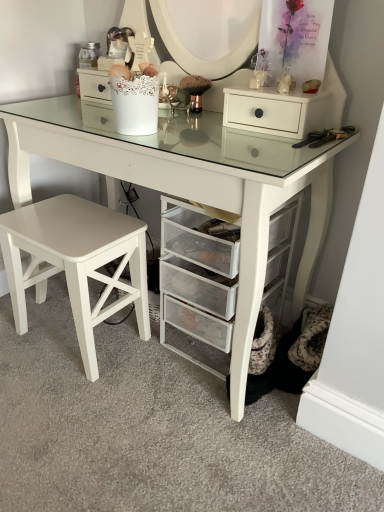
Question: From the image's perspective, is white matte drawer at upper right under clear mesh drawers at center?

Choices:
 (A) no
 (B) yes

Answer: (A)

Question: Can you confirm if white matte drawer at upper right is bigger than clear mesh drawers at center?

Choices:
 (A) yes
 (B) no

Answer: (B)

Question: Considering the relative sizes of white matte drawer at upper right and clear mesh drawers at center in the image provided, is white matte drawer at upper right taller than clear mesh drawers at center?

Choices:
 (A) yes
 (B) no

Answer: (B)

Question: Is white matte drawer at upper right to the right of clear mesh drawers at center from the viewer's perspective?

Choices:
 (A) yes
 (B) no

Answer: (A)

Question: Is white matte drawer at upper right surrounding clear mesh drawers at center?

Choices:
 (A) yes
 (B) no

Answer: (B)

Question: From a real-world perspective, is white matte drawer at upper right beneath clear mesh drawers at center?

Choices:
 (A) no
 (B) yes

Answer: (A)

Question: Are clear mesh drawers at center and white matte stool at lower left far apart?

Choices:
 (A) no
 (B) yes

Answer: (A)

Question: From a real-world perspective, is clear mesh drawers at center on top of white matte stool at lower left?

Choices:
 (A) yes
 (B) no

Answer: (A)

Question: Is clear mesh drawers at center positioned behind white matte stool at lower left?

Choices:
 (A) yes
 (B) no

Answer: (B)

Question: Can you confirm if clear mesh drawers at center is taller than white matte stool at lower left?

Choices:
 (A) no
 (B) yes

Answer: (B)

Question: Can you confirm if clear mesh drawers at center is shorter than white matte stool at lower left?

Choices:
 (A) yes
 (B) no

Answer: (B)

Question: Is the depth of clear mesh drawers at center less than that of white matte stool at lower left?

Choices:
 (A) no
 (B) yes

Answer: (B)

Question: Is white matte drawer at upper right shorter than white matte stool at lower left?

Choices:
 (A) yes
 (B) no

Answer: (A)